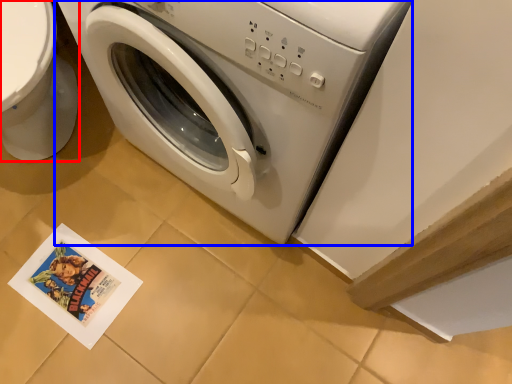
Question: Among these objects, which one is farthest to the camera, toilet bowl (highlighted by a red box) or washing machine (highlighted by a blue box)?

Choices:
 (A) toilet bowl
 (B) washing machine

Answer: (A)